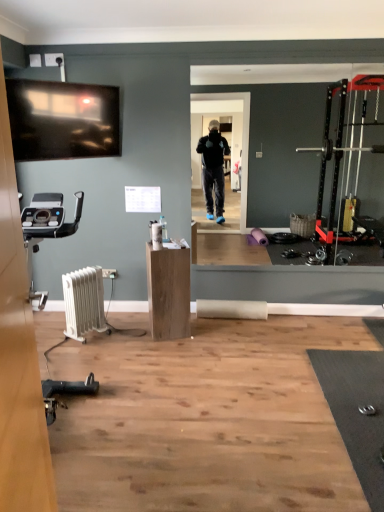
Question: Does white plastic radiator at lower left appear on the left side of wooden cabinet at center?

Choices:
 (A) no
 (B) yes

Answer: (B)

Question: Could you tell me if white plastic radiator at lower left is turned towards wooden cabinet at center?

Choices:
 (A) yes
 (B) no

Answer: (B)

Question: Is white plastic radiator at lower left smaller than wooden cabinet at center?

Choices:
 (A) yes
 (B) no

Answer: (A)

Question: From the image's perspective, does white plastic radiator at lower left appear higher than wooden cabinet at center?

Choices:
 (A) no
 (B) yes

Answer: (A)

Question: Would you say white plastic radiator at lower left contains wooden cabinet at center?

Choices:
 (A) no
 (B) yes

Answer: (A)

Question: Does white plastic radiator at lower left have a lesser height compared to wooden cabinet at center?

Choices:
 (A) yes
 (B) no

Answer: (A)

Question: Considering the relative positions of wooden cabinet at center and white plastic radiator at lower left in the image provided, is wooden cabinet at center to the right of white plastic radiator at lower left from the viewer's perspective?

Choices:
 (A) yes
 (B) no

Answer: (A)

Question: Considering the relative positions of wooden cabinet at center and white plastic radiator at lower left in the image provided, is wooden cabinet at center in front of white plastic radiator at lower left?

Choices:
 (A) no
 (B) yes

Answer: (A)

Question: Is the surface of wooden cabinet at center in direct contact with white plastic radiator at lower left?

Choices:
 (A) no
 (B) yes

Answer: (A)

Question: Is wooden cabinet at center facing towards white plastic radiator at lower left?

Choices:
 (A) no
 (B) yes

Answer: (A)

Question: Is the position of wooden cabinet at center more distant than that of white plastic radiator at lower left?

Choices:
 (A) no
 (B) yes

Answer: (B)

Question: Can you confirm if wooden cabinet at center is smaller than white plastic radiator at lower left?

Choices:
 (A) no
 (B) yes

Answer: (A)

Question: Considering the positions of wooden cabinet at center and white plastic radiator at lower left in the image, is wooden cabinet at center taller or shorter than white plastic radiator at lower left?

Choices:
 (A) tall
 (B) short

Answer: (A)